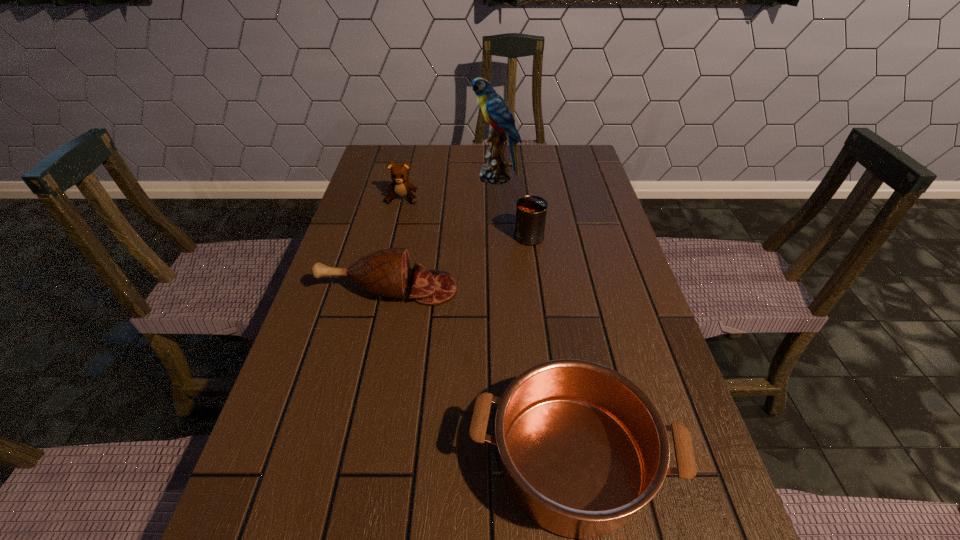
You are a GUI agent. You are given a task and a screenshot of the screen. Output one action in this format:
    pyautogui.click(x=<x>, y=<y>)
    Task: Click on the farthest object
    
    Given the screenshot: What is the action you would take?
    pyautogui.click(x=494, y=109)

Where is `the tallest object`? the tallest object is located at coordinates click(494, 109).

Identify the location of can. The image size is (960, 540). (531, 211).

Identify the location of the second tallest object. This screenshot has height=540, width=960. (531, 211).

I want to click on the second farthest object, so click(x=400, y=187).

At what (x,y) coordinates should I click in order to perform the action: click on the second nearest object. Please return your answer as a coordinate pair (x, y). The height and width of the screenshot is (540, 960). Looking at the image, I should click on (386, 272).

At what (x,y) coordinates should I click in order to perform the action: click on vacant area situated on the face of the tallest object. Please return your answer as a coordinate pair (x, y). The image size is (960, 540). Looking at the image, I should click on (375, 177).

Find the location of a particular element. The image size is (960, 540). free location located 0.120m on the face of the tallest object is located at coordinates (436, 177).

Where is `free spot located 0.250m on the face of the tallest object`? free spot located 0.250m on the face of the tallest object is located at coordinates (396, 177).

Find the location of a particular element. The height and width of the screenshot is (540, 960). vacant region located on the front of the second tallest object is located at coordinates 538,302.